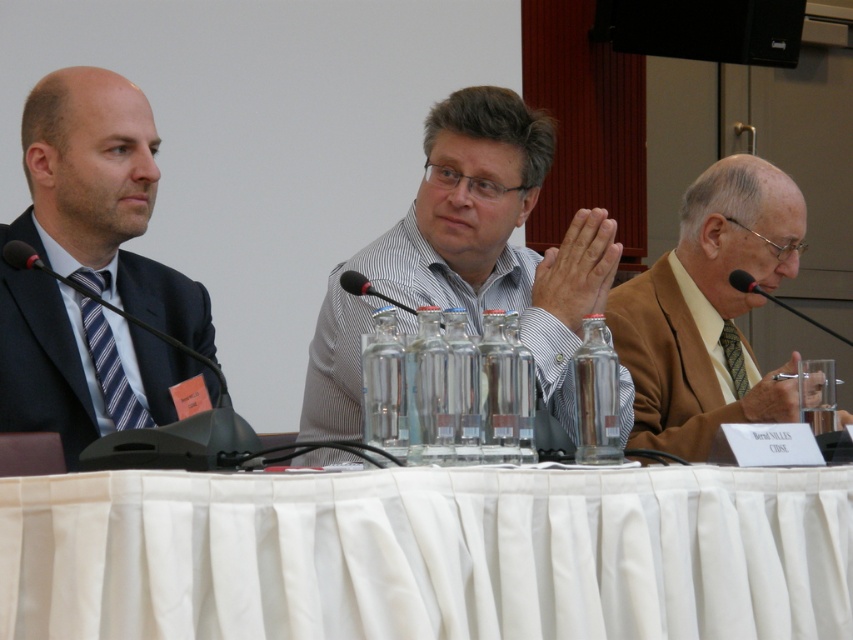
Is matte black suit at left taller than black plastic microphone at center?

Yes.

Between point (138, 332) and point (340, 284), which one is positioned behind?

Positioned behind is point (138, 332).

Locate an element on the screen. This screenshot has height=640, width=853. matte black suit at left is located at coordinates (102, 198).

Between white striped shirt at center and light brown suit at right, which one appears on the left side from the viewer's perspective?

white striped shirt at center

Find the location of a particular element. The height and width of the screenshot is (640, 853). white striped shirt at center is located at coordinates (468, 257).

Does light brown suit at right appear on the left side of black plastic microphone at center?

Incorrect, light brown suit at right is not on the left side of black plastic microphone at center.

The image size is (853, 640). Identify the location of light brown suit at right. (709, 310).

Consider the image. Who is more distant from viewer, (711, 228) or (376, 296)?

The point (711, 228) is behind.

This screenshot has height=640, width=853. I want to click on light brown suit at right, so click(709, 310).